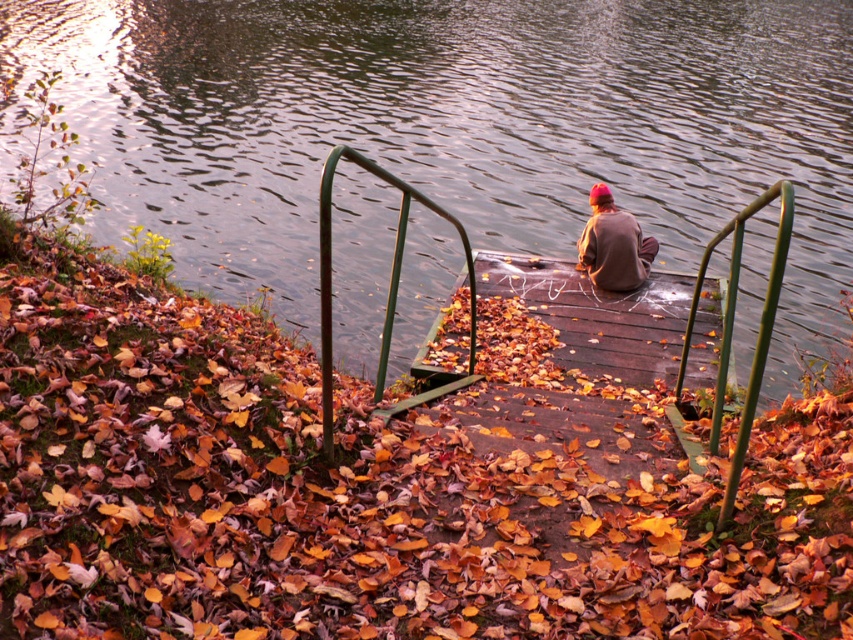
Question: Considering the relative positions of glossy water at upper center and brown matte jacket at center in the image provided, where is glossy water at upper center located with respect to brown matte jacket at center?

Choices:
 (A) above
 (B) below

Answer: (A)

Question: Which point appears farthest from the camera in this image?

Choices:
 (A) 712,360
 (B) 347,156
 (C) 202,156

Answer: (C)

Question: Among these points, which one is nearest to the camera?

Choices:
 (A) (332, 147)
 (B) (631, 280)
 (C) (653, 276)
 (D) (277, 509)

Answer: (D)

Question: Which point is closer to the camera?

Choices:
 (A) glossy water at upper center
 (B) wooden dock at center
 (C) green metal rail at center

Answer: (B)

Question: Is autumn leaves at center further to camera compared to wooden dock at center?

Choices:
 (A) yes
 (B) no

Answer: (B)

Question: In this image, where is wooden dock at center located relative to brown matte jacket at center?

Choices:
 (A) above
 (B) below

Answer: (B)